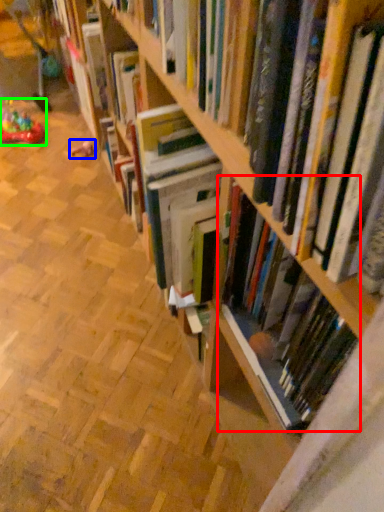
Question: Which is farther away from book (highlighted by a red box)? toy (highlighted by a blue box) or toy (highlighted by a green box)?

Choices:
 (A) toy
 (B) toy

Answer: (B)